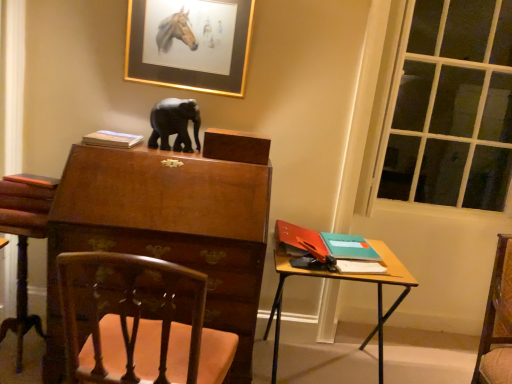
I want to click on free area below transparent glass window at right (from a real-world perspective), so click(x=402, y=354).